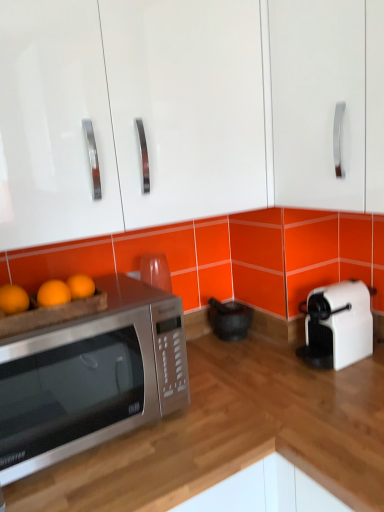
Question: Looking at their shapes, would you say white glossy cabinet handle at upper right, acting as the second cabinetry starting from the left, is wider or thinner than satin silver microwave at left?

Choices:
 (A) thin
 (B) wide

Answer: (A)

Question: In terms of size, does white glossy cabinet handle at upper right, acting as the second cabinetry starting from the left, appear bigger or smaller than satin silver microwave at left?

Choices:
 (A) big
 (B) small

Answer: (A)

Question: Which is nearer to the glossy white cabinet at upper center, placed as the 1th cabinetry when sorted from left to right?

Choices:
 (A) black matte mortar and pestle at center
 (B) silver metallic microwave at lower left
 (C) satin silver microwave at left
 (D) white glossy cabinet handle at upper right, which is the first cabinetry from right to left
 (E) white plastic toaster at right

Answer: (D)

Question: Which object is positioned farthest from the silver metallic microwave at lower left?

Choices:
 (A) glossy white cabinet at upper center, positioned as the second cabinetry in right-to-left order
 (B) satin silver microwave at left
 (C) white plastic toaster at right
 (D) white glossy cabinet handle at upper right, which is the first cabinetry from right to left
 (E) black matte mortar and pestle at center

Answer: (A)